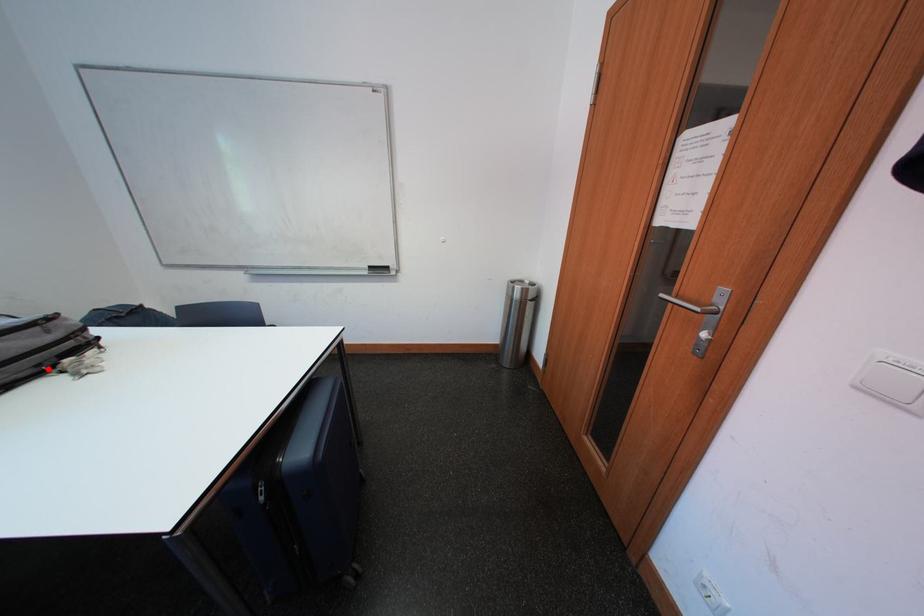
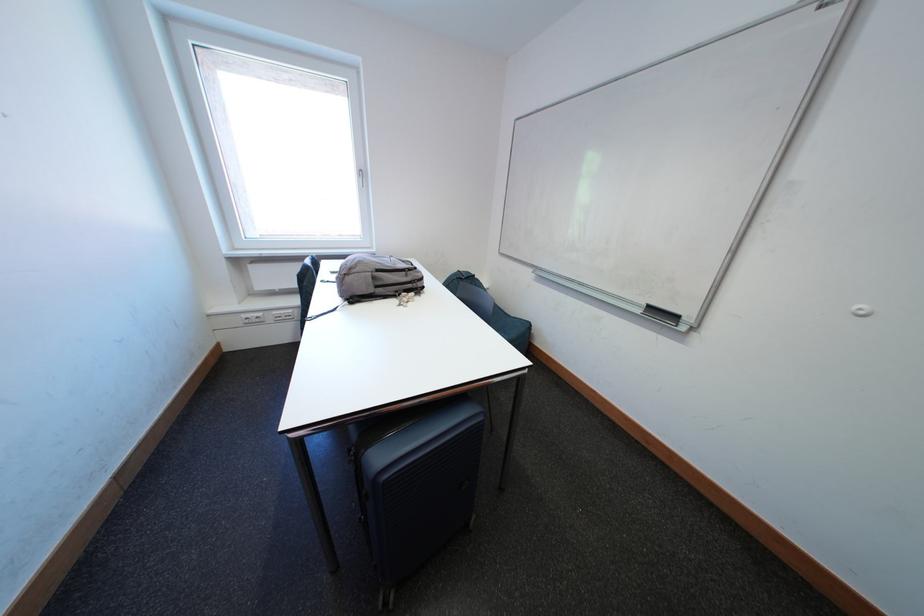
The point at the highlighted location is marked in the first image. Where is the corresponding point in the second image?

(406, 294)